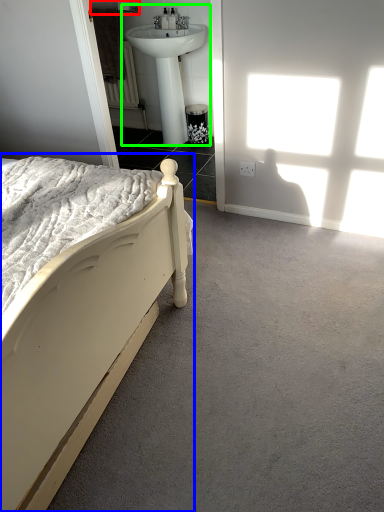
Question: Estimate the real-world distances between objects in this image. Which object is farther from towel bar (highlighted by a red box), bed (highlighted by a blue box) or sink (highlighted by a green box)?

Choices:
 (A) bed
 (B) sink

Answer: (A)